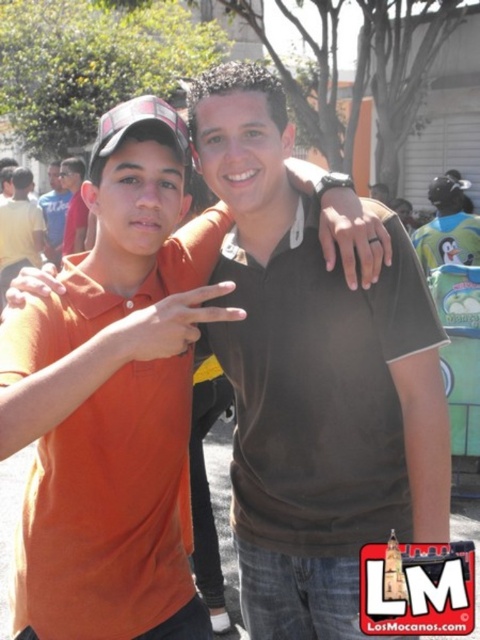
Question: From the image, what is the correct spatial relationship of orange cotton shirt at left in relation to matte black shirt at center?

Choices:
 (A) below
 (B) above

Answer: (A)

Question: Which object is the farthest from the orange cotton shirt at left?

Choices:
 (A) matte black shirt at center
 (B) orange cotton shirt at center

Answer: (B)

Question: Considering the real-world distances, which object is farthest from the orange cotton shirt at center?

Choices:
 (A) matte black shirt at center
 (B) matte black polo shirt at center

Answer: (A)

Question: Does orange cotton shirt at center have a larger size compared to orange cotton shirt at left?

Choices:
 (A) no
 (B) yes

Answer: (A)

Question: Is matte black polo shirt at center wider than orange cotton shirt at center?

Choices:
 (A) yes
 (B) no

Answer: (A)

Question: Estimate the real-world distances between objects in this image. Which object is farther from the matte black polo shirt at center?

Choices:
 (A) matte orange shirt at left
 (B) matte black shirt at center
 (C) orange cotton shirt at center

Answer: (B)